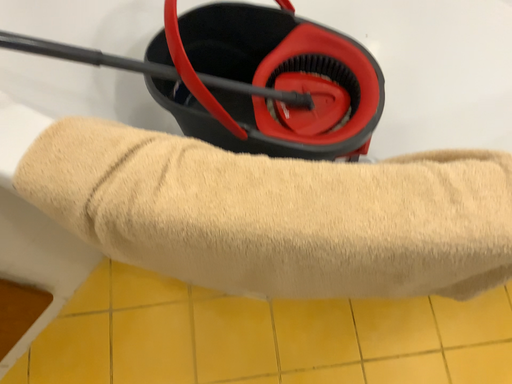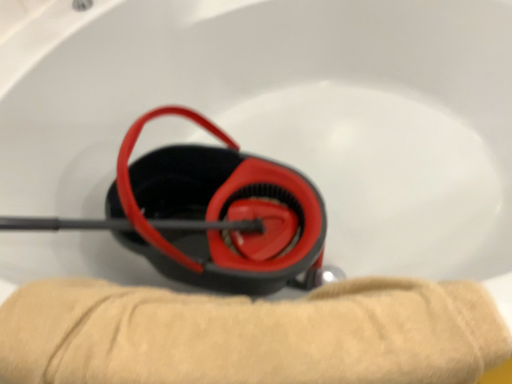
Question: Which way did the camera rotate in the video?

Choices:
 (A) rotated upward
 (B) rotated downward

Answer: (A)